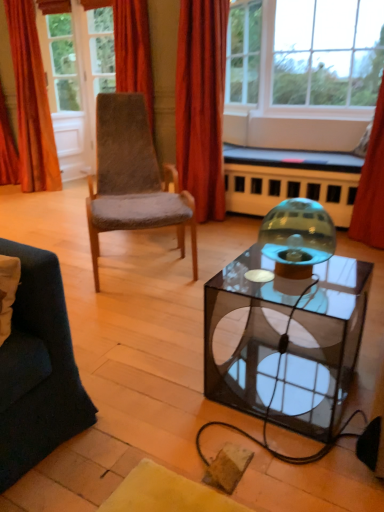
Question: Considering the relative positions of transparent glass door at upper left and clear glass window at upper center, which is the first window in left-to-right order, in the image provided, is transparent glass door at upper left to the right of clear glass window at upper center, which is the first window in left-to-right order, from the viewer's perspective?

Choices:
 (A) yes
 (B) no

Answer: (B)

Question: Does transparent glass door at upper left come behind clear glass window at upper center, which is the first window in left-to-right order?

Choices:
 (A) no
 (B) yes

Answer: (B)

Question: Can you confirm if transparent glass door at upper left is smaller than clear glass window at upper center, which is the first window in left-to-right order?

Choices:
 (A) no
 (B) yes

Answer: (A)

Question: Is transparent glass door at upper left thinner than clear glass window at upper center, which ranks as the 2th window in right-to-left order?

Choices:
 (A) yes
 (B) no

Answer: (B)

Question: From a real-world perspective, is transparent glass door at upper left on clear glass window at upper center, which is the first window in left-to-right order?

Choices:
 (A) yes
 (B) no

Answer: (B)

Question: From a real-world perspective, is orange velvet curtain at upper left, which is the 3th curtain in right-to-left order, physically located above or below clear glass window at upper center, which is the first window in left-to-right order?

Choices:
 (A) below
 (B) above

Answer: (A)

Question: Considering the positions of orange velvet curtain at upper left, which is the 3th curtain in right-to-left order, and clear glass window at upper center, which is the first window in left-to-right order, in the image, is orange velvet curtain at upper left, which is the 3th curtain in right-to-left order, wider or thinner than clear glass window at upper center, which is the first window in left-to-right order,?

Choices:
 (A) wide
 (B) thin

Answer: (A)

Question: Based on their sizes in the image, would you say orange velvet curtain at upper left, the 1th curtain in the left-to-right sequence, is bigger or smaller than clear glass window at upper center, which ranks as the 2th window in right-to-left order?

Choices:
 (A) small
 (B) big

Answer: (B)

Question: From the image's perspective, is orange velvet curtain at upper left, the 1th curtain in the left-to-right sequence, above or below clear glass window at upper center, which is the first window in left-to-right order?

Choices:
 (A) above
 (B) below

Answer: (B)

Question: From a real-world perspective, is transparent glass candle holder at center physically located above or below orange velvet curtain at upper left, the 1th curtain in the left-to-right sequence?

Choices:
 (A) above
 (B) below

Answer: (B)

Question: From the image's perspective, is transparent glass candle holder at center above or below orange velvet curtain at upper left, the 1th curtain in the left-to-right sequence?

Choices:
 (A) below
 (B) above

Answer: (A)

Question: Which is correct: transparent glass candle holder at center is inside orange velvet curtain at upper left, which is the 3th curtain in right-to-left order, or outside of it?

Choices:
 (A) outside
 (B) inside

Answer: (A)

Question: Considering the positions of transparent glass candle holder at center and orange velvet curtain at upper left, the 1th curtain in the left-to-right sequence, in the image, is transparent glass candle holder at center taller or shorter than orange velvet curtain at upper left, the 1th curtain in the left-to-right sequence,?

Choices:
 (A) short
 (B) tall

Answer: (A)

Question: In terms of size, does transparent glass table at center appear bigger or smaller than transparent glass door at upper left?

Choices:
 (A) small
 (B) big

Answer: (B)

Question: Is transparent glass table at center to the left or to the right of transparent glass door at upper left in the image?

Choices:
 (A) right
 (B) left

Answer: (A)